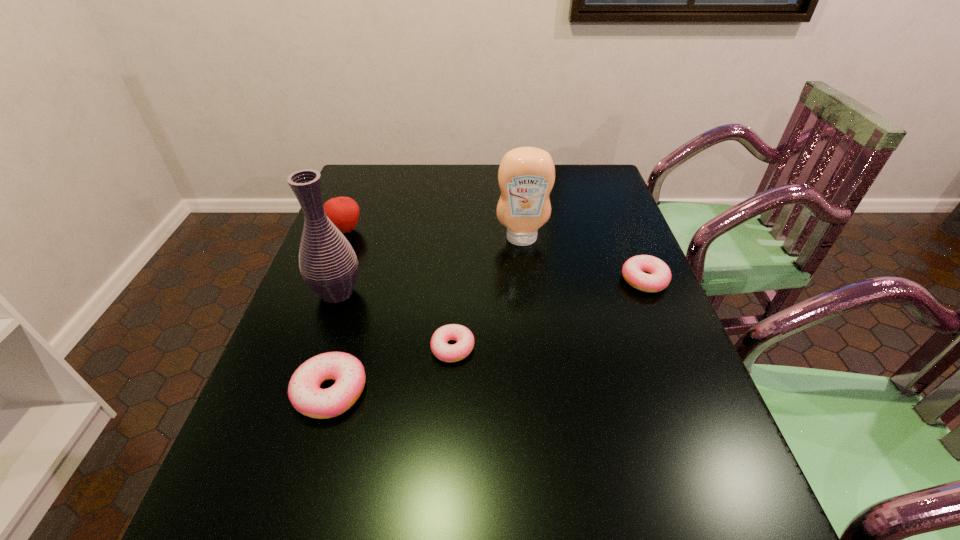
Find the location of `vacant space located 0.210m on the back of the third shortest object`. vacant space located 0.210m on the back of the third shortest object is located at coordinates (358, 296).

Identify the location of vacant position located on the left of the shortest doughnut. (304, 348).

This screenshot has width=960, height=540. I want to click on free space located 0.160m on the left of the second shortest object, so click(x=562, y=280).

Identify the location of vacant region located on the label of the second tallest object. This screenshot has height=540, width=960. (527, 288).

Locate an element on the screen. The width and height of the screenshot is (960, 540). free space located on the back of the fourth shortest object is located at coordinates (364, 183).

The width and height of the screenshot is (960, 540). I want to click on blank space located on the front of the tallest object, so click(x=320, y=343).

Identify the location of doughnut that is at the left edge. (304, 392).

Locate an element on the screen. Image resolution: width=960 pixels, height=540 pixels. apple present at the left edge is located at coordinates pos(343,211).

The height and width of the screenshot is (540, 960). What are the coordinates of `vase present at the left edge` in the screenshot? It's located at (328, 264).

Where is `object located at the right edge`? object located at the right edge is located at coordinates (659, 277).